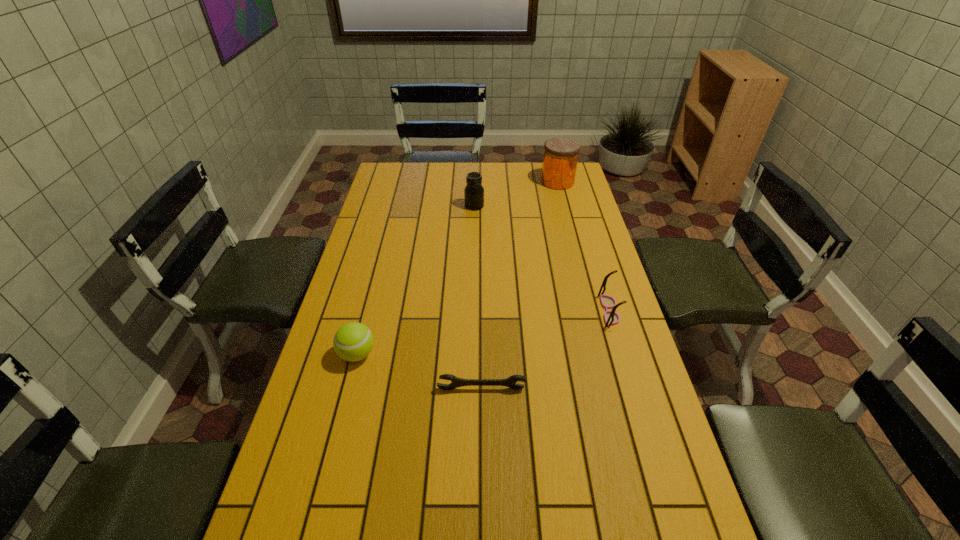
Image resolution: width=960 pixels, height=540 pixels. Identify the location of vacant space that's between the nearest object and the farther jar. (519, 285).

Image resolution: width=960 pixels, height=540 pixels. I want to click on vacant area that lies between the fourth nearest object and the spectacles, so click(x=541, y=258).

Image resolution: width=960 pixels, height=540 pixels. In order to click on object identified as the second closest to the shorter jar in this screenshot , I will do coord(611,318).

You are a GUI agent. You are given a task and a screenshot of the screen. Output one action in this format:
    pyautogui.click(x=<x>, y=<y>)
    Task: Click on the object identified as the fourth closest to the shortest object
    
    Given the screenshot: What is the action you would take?
    pyautogui.click(x=560, y=159)

Locate an element on the screen. vacant space that satisfies the following two spatial constraints: 1. on the back side of the nearer jar; 2. on the left side of the leftmost object is located at coordinates (396, 206).

I want to click on vacant space that satisfies the following two spatial constraints: 1. on the back side of the left jar; 2. on the left side of the farther jar, so click(x=475, y=181).